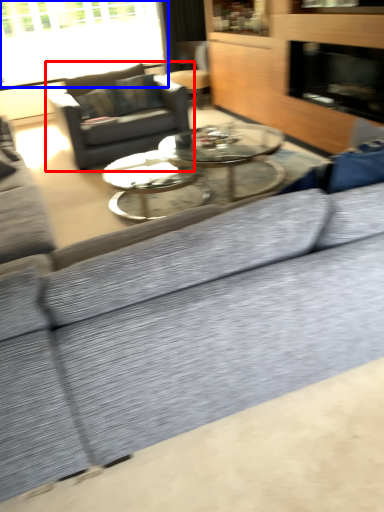
Question: Which object is closer to the camera taking this photo, studio couch (highlighted by a red box) or window (highlighted by a blue box)?

Choices:
 (A) studio couch
 (B) window

Answer: (A)